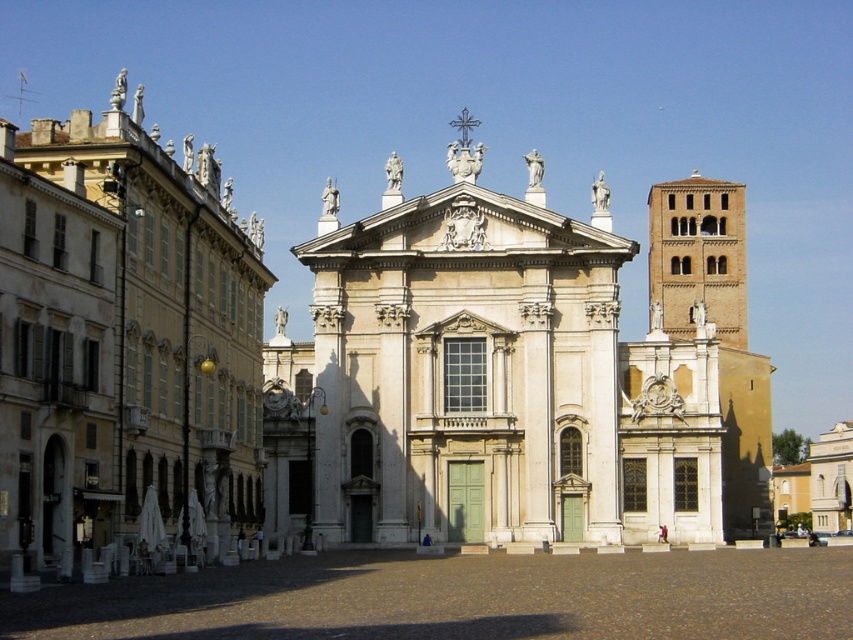
Which is above, beige stone church at center or beige stone church at left?

beige stone church at left is above.

What do you see at coordinates (500, 371) in the screenshot? This screenshot has width=853, height=640. I see `beige stone church at center` at bounding box center [500, 371].

Find the location of a particular element. The width and height of the screenshot is (853, 640). beige stone church at center is located at coordinates (500, 371).

At what (x,y) coordinates should I click in order to perform the action: click on beige stone church at center. Please return your answer as a coordinate pair (x, y). This screenshot has width=853, height=640. Looking at the image, I should click on (500, 371).

Can you confirm if beige stone church at center is wider than brown brick tower at upper right?

Yes, beige stone church at center is wider than brown brick tower at upper right.

At what (x,y) coordinates should I click in order to perform the action: click on beige stone church at center. Please return your answer as a coordinate pair (x, y). Looking at the image, I should click on (500, 371).

Which is more to the left, beige stone church at left or brown brick tower at upper right?

beige stone church at left is more to the left.

Who is more forward, (x=39, y=157) or (x=701, y=227)?

Point (x=39, y=157)

Locate an element on the screen. The image size is (853, 640). beige stone church at left is located at coordinates (125, 340).